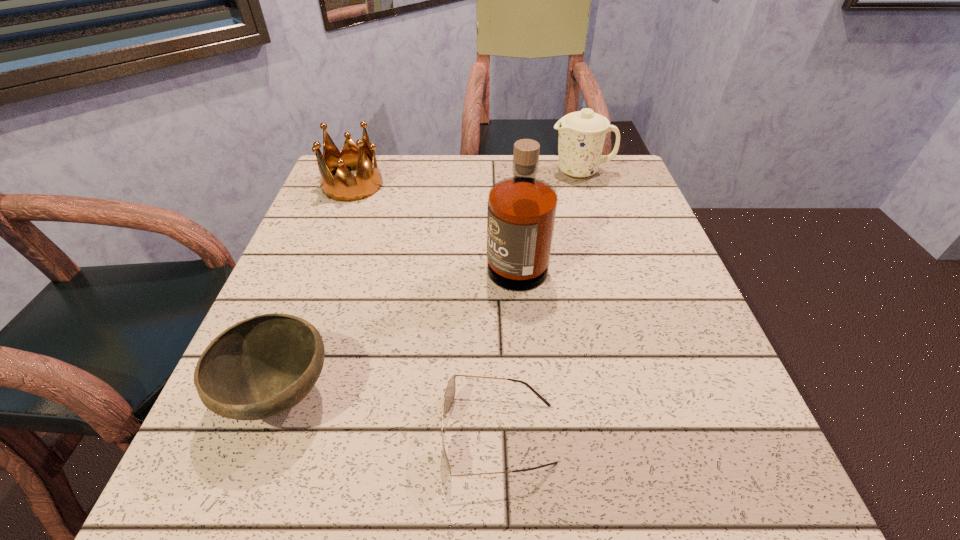
Where is `crown that is at the left edge`? This screenshot has width=960, height=540. crown that is at the left edge is located at coordinates (344, 186).

The image size is (960, 540). What are the coordinates of `bowl situated at the left edge` in the screenshot? It's located at (260, 367).

You are a GUI agent. You are given a task and a screenshot of the screen. Output one action in this format:
    pyautogui.click(x=<x>, y=<y>)
    Task: Click on the object present at the right edge
    The width and height of the screenshot is (960, 540).
    Given the screenshot: What is the action you would take?
    pyautogui.click(x=581, y=137)

Where is `object present at the far left corner`? This screenshot has width=960, height=540. object present at the far left corner is located at coordinates (344, 186).

This screenshot has width=960, height=540. Identify the location of object that is at the far right corner. (581, 137).

In the image, there is a desktop. At what (x,y) coordinates should I click in order to perform the action: click on vacant space at the far edge. Please return your answer as a coordinate pair (x, y). The image size is (960, 540). Looking at the image, I should click on [512, 158].

This screenshot has width=960, height=540. What are the coordinates of `blank space at the near edge` in the screenshot? It's located at (591, 509).

In the image, there is a desktop. Find the location of `vacant space at the left edge`. vacant space at the left edge is located at coordinates (325, 318).

Find the location of `vacant space at the right edge of the desktop`. vacant space at the right edge of the desktop is located at coordinates (625, 261).

You are a GUI agent. You are given a task and a screenshot of the screen. Output one action in this format:
    pyautogui.click(x=<x>, y=<y>)
    Task: Click on the vacant space at the far left corner of the desktop
    
    Given the screenshot: What is the action you would take?
    pyautogui.click(x=319, y=195)